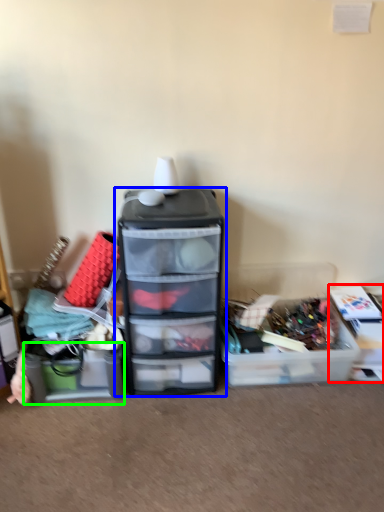
Question: Which object is positioned farthest from storage box (highlighted by a red box)? Select from furniture (highlighted by a blue box) and storage box (highlighted by a green box).

Choices:
 (A) furniture
 (B) storage box

Answer: (B)